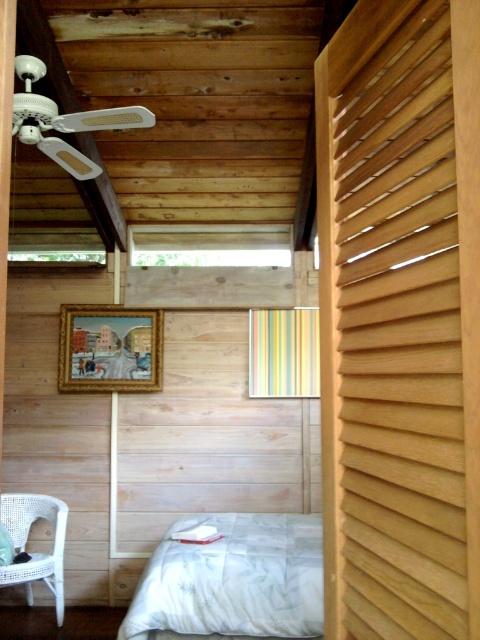
You are planning to place a small decorative item on the floor between the white wicker chair at lower left and the white soft pillow at lower center. Considering their sizes, which object should you place it closer to so it doesn

The white wicker chair at lower left is bigger than the white soft pillow at lower center. Therefore, you should place the decorative item closer to the white soft pillow at lower center to ensure there is enough space around the larger chair.

You are standing in the room and want to locate the light brown wooden slats at right. According to their 2D coordinates, where would you look relative to the center of the image?

The light brown wooden slats at right are located at 0.500 on the x axis and 0.833 on the y axis, which means they are halfway across the image from left to right and 83.3 percent up from the bottom to the top.